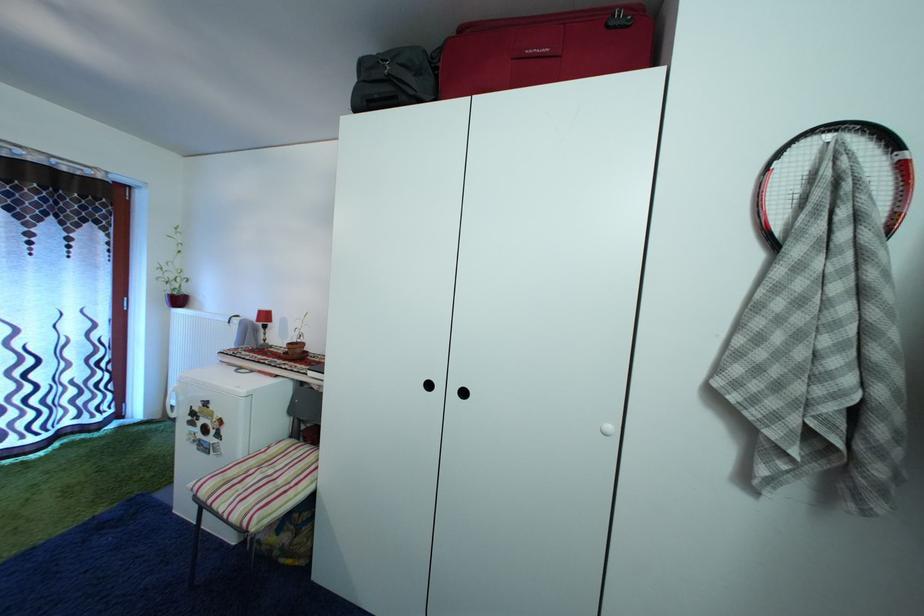
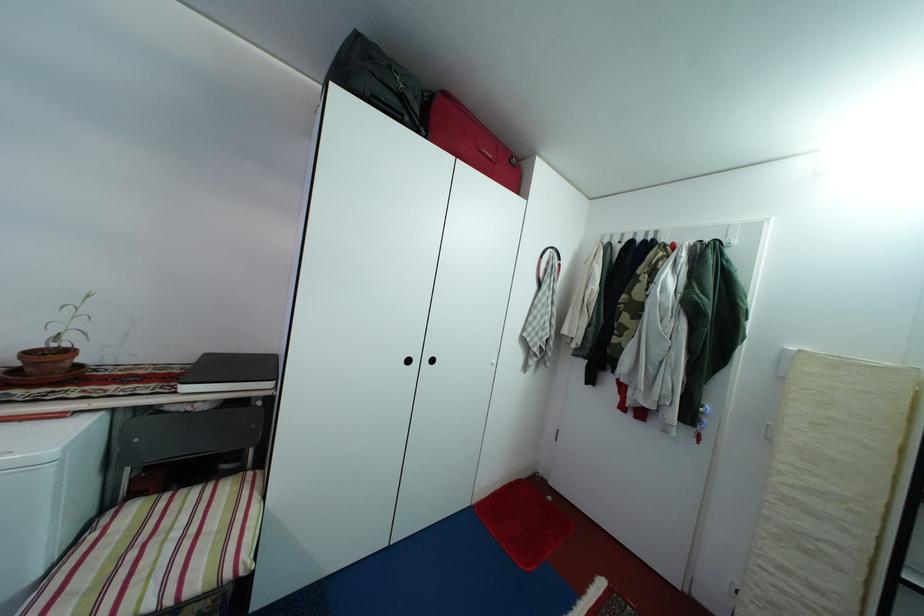
In the second image, find the point that corresponds to point (406, 105) in the first image.

(410, 123)